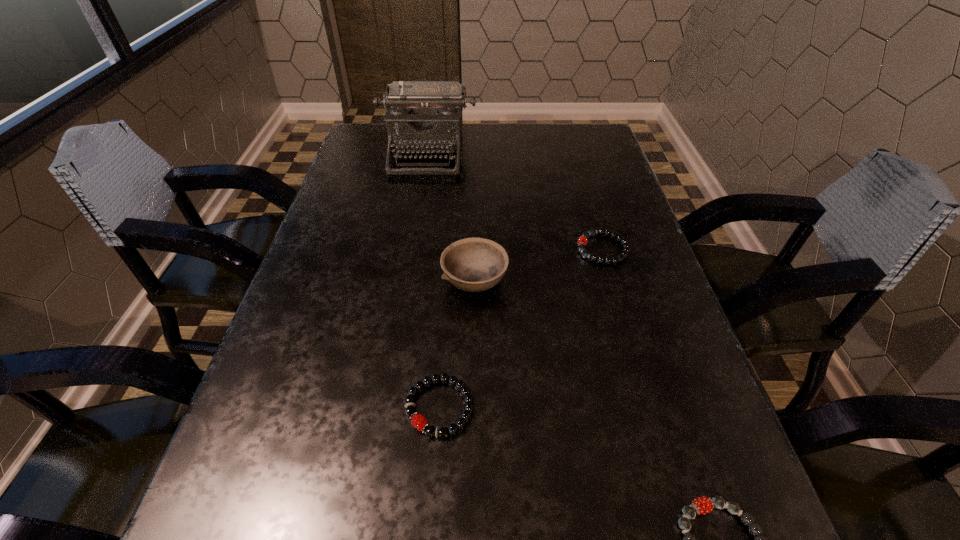
The height and width of the screenshot is (540, 960). What are the coordinates of `typewriter` in the screenshot? It's located at (423, 117).

Locate an element on the screen. Image resolution: width=960 pixels, height=540 pixels. the tallest object is located at coordinates (423, 117).

Find the location of a particular element. This screenshot has width=960, height=540. the second tallest object is located at coordinates (473, 264).

Locate an element on the screen. The width and height of the screenshot is (960, 540). the farthest bracelet is located at coordinates (582, 241).

The image size is (960, 540). Identify the location of the second nearest object. (418, 421).

You are a GUI agent. You are given a task and a screenshot of the screen. Output one action in this format:
    pyautogui.click(x=<x>, y=<y>)
    Task: Click on the leftmost bracelet
    The width and height of the screenshot is (960, 540).
    Given the screenshot: What is the action you would take?
    pyautogui.click(x=418, y=421)

I want to click on vacant space located on the typing side of the farthest object, so click(x=421, y=190).

Identify the location of vacant area situated on the back of the bowl. This screenshot has width=960, height=540. (476, 172).

Where is `vacant point located on the left of the farthest bracelet`? This screenshot has height=540, width=960. vacant point located on the left of the farthest bracelet is located at coordinates (522, 249).

Where is `free location located on the right of the leftmost bracelet`? free location located on the right of the leftmost bracelet is located at coordinates (622, 407).